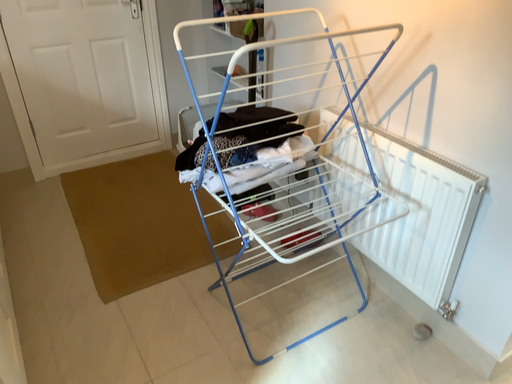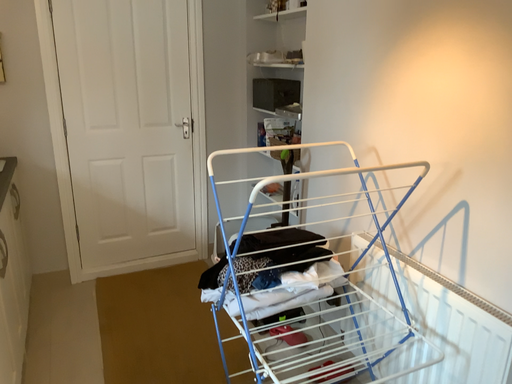
Question: How did the camera likely rotate when shooting the video?

Choices:
 (A) rotated upward
 (B) rotated downward

Answer: (A)